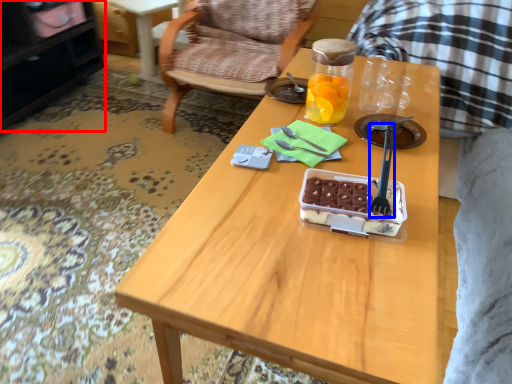
Question: Which object is further to the camera taking this photo, cabinetry (highlighted by a red box) or fork (highlighted by a blue box)?

Choices:
 (A) cabinetry
 (B) fork

Answer: (A)